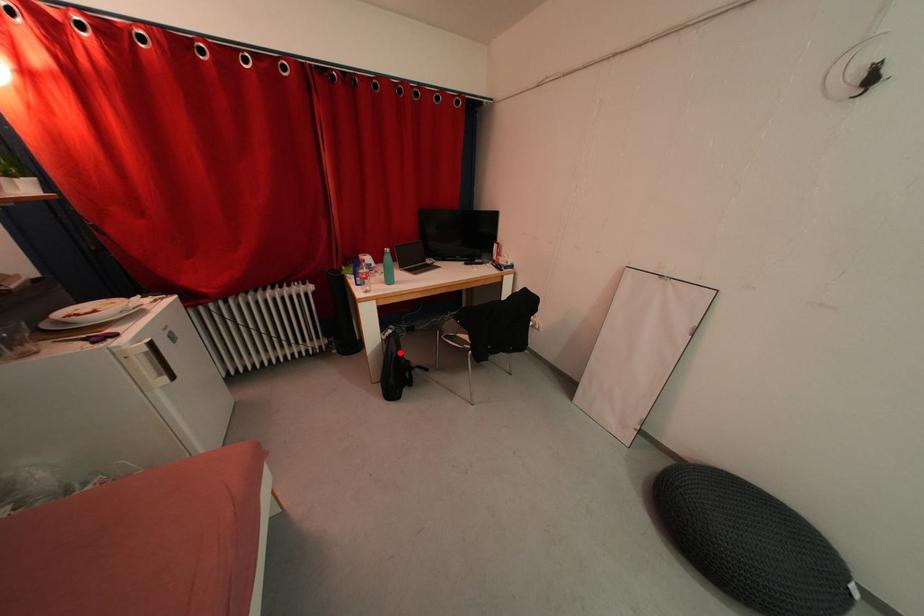
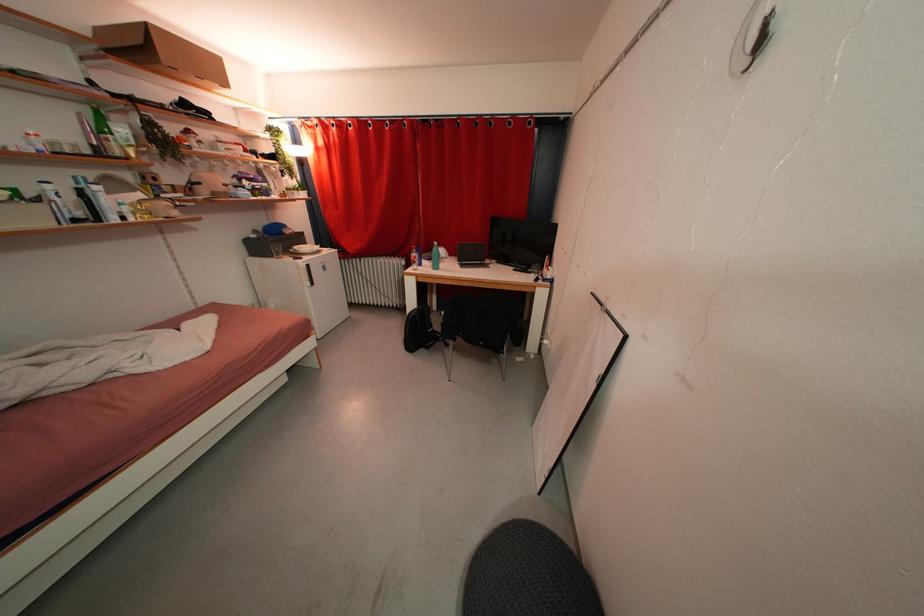
Question: I am providing you with two images of the same scene from different viewpoints. Image1 has a red point marked. In image2, the corresponding 3D location appears at what relative position? Reply with the corresponding letter.

Choices:
 (A) Closer
 (B) Farther

Answer: (B)